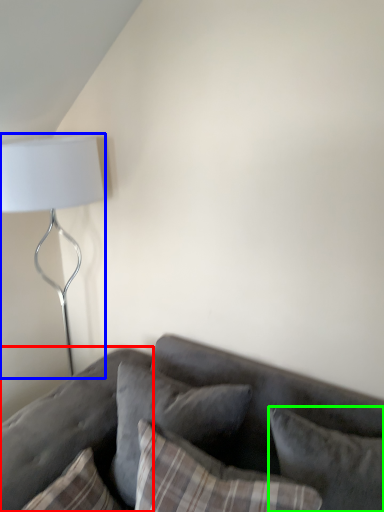
Question: Considering the real-world distances, which object is closest to pillow (highlighted by a red box)? lamp (highlighted by a blue box) or pillow (highlighted by a green box).

Choices:
 (A) lamp
 (B) pillow

Answer: (B)